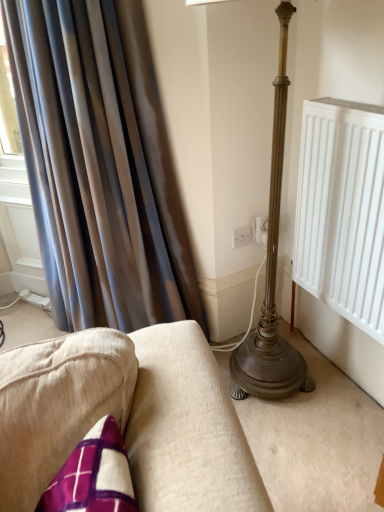
Question: From a real-world perspective, is white plastic socket at center, arranged as the second electric outlet when viewed from the left, below silky brown curtain at left?

Choices:
 (A) no
 (B) yes

Answer: (B)

Question: Does white plastic socket at center, arranged as the second electric outlet when viewed from the left, have a smaller size compared to silky brown curtain at left?

Choices:
 (A) yes
 (B) no

Answer: (A)

Question: Can you confirm if white plastic socket at center, arranged as the second electric outlet when viewed from the left, is taller than silky brown curtain at left?

Choices:
 (A) yes
 (B) no

Answer: (B)

Question: From a real-world perspective, does white plastic socket at center, arranged as the second electric outlet when viewed from the left, stand above silky brown curtain at left?

Choices:
 (A) no
 (B) yes

Answer: (A)

Question: Is white plastic socket at center, which is the 1th electric outlet from right to left, positioned behind silky brown curtain at left?

Choices:
 (A) yes
 (B) no

Answer: (A)

Question: Is white plastic socket at center, which is the 1th electric outlet from right to left, at the right side of silky brown curtain at left?

Choices:
 (A) yes
 (B) no

Answer: (A)

Question: Would you say silky brown curtain at left contains white plastic electric outlet at center, which is counted as the second electric outlet, starting from the right?

Choices:
 (A) no
 (B) yes

Answer: (A)

Question: Is silky brown curtain at left outside of white plastic electric outlet at center, which is the first electric outlet in left-to-right order?

Choices:
 (A) no
 (B) yes

Answer: (B)

Question: From the image's perspective, is silky brown curtain at left beneath white plastic electric outlet at center, which is counted as the second electric outlet, starting from the right?

Choices:
 (A) no
 (B) yes

Answer: (A)

Question: Can you confirm if silky brown curtain at left is wider than white plastic electric outlet at center, which is counted as the second electric outlet, starting from the right?

Choices:
 (A) no
 (B) yes

Answer: (B)

Question: From a real-world perspective, is silky brown curtain at left on white plastic electric outlet at center, which is the first electric outlet in left-to-right order?

Choices:
 (A) yes
 (B) no

Answer: (A)

Question: From the image's perspective, is silky brown curtain at left above white plastic electric outlet at center, which is counted as the second electric outlet, starting from the right?

Choices:
 (A) no
 (B) yes

Answer: (B)

Question: Considering the relative sizes of white plastic electric outlet at center, which is the first electric outlet in left-to-right order, and silky brown curtain at left in the image provided, is white plastic electric outlet at center, which is the first electric outlet in left-to-right order, shorter than silky brown curtain at left?

Choices:
 (A) yes
 (B) no

Answer: (A)